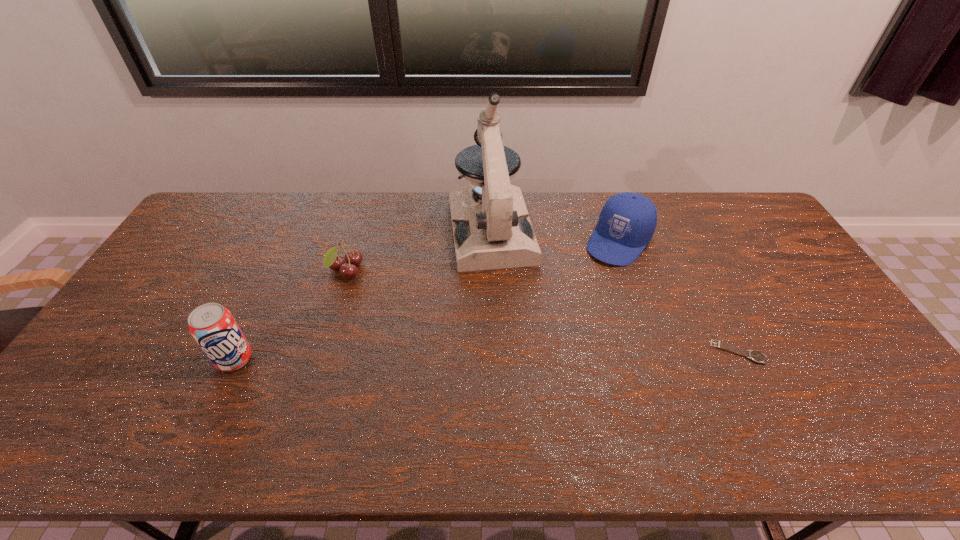
At what (x,y) coordinates should I click in order to perform the action: click on vacant spot on the desktop that is between the soda can and the rightmost object and is positioned on the leaves of the second shortest object. Please return your answer as a coordinate pair (x, y). This screenshot has height=540, width=960. Looking at the image, I should click on (501, 355).

Find the location of `vacant space on the desktop that is between the soda can and the rightmost object and is positioned at the eyepiece of the microscope`. vacant space on the desktop that is between the soda can and the rightmost object and is positioned at the eyepiece of the microscope is located at coordinates click(518, 355).

At what (x,y) coordinates should I click in order to perform the action: click on vacant spot on the desktop that is between the leftmost object and the rightmost object and is positioned on the front-facing side of the second object from right to left. Please return your answer as a coordinate pair (x, y). The image size is (960, 540). Looking at the image, I should click on 533,355.